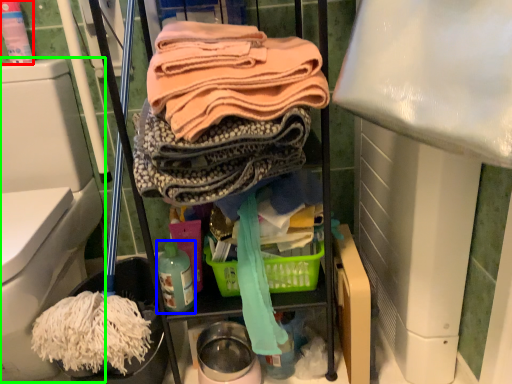
Question: Which is farther away from cleaning product (highlighted by a red box)? bottle (highlighted by a blue box) or bidet (highlighted by a green box)?

Choices:
 (A) bottle
 (B) bidet

Answer: (A)